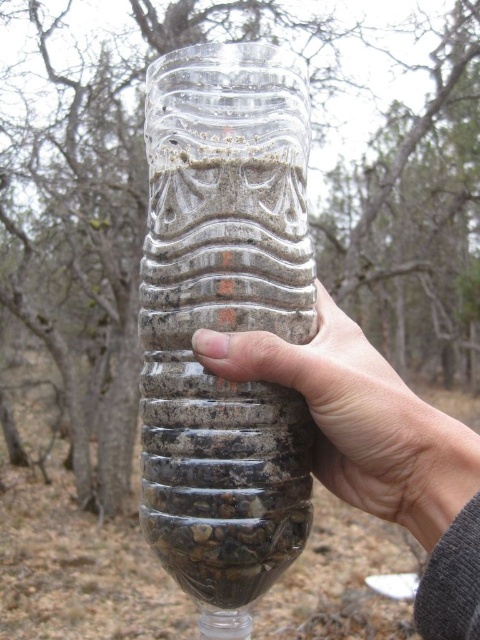
You are trying to choose between two containers to store some gardening soil. You have a clear textured glass jar at center and a clear plastic bottle at center. Which one is taller?

The clear textured glass jar at center is taller than the clear plastic bottle at center.

You are a delivery person who needs to place the clear textured glass jar at center into a box that can only hold items within a 10cm radius from the center. Is the jar positioned correctly within the box?

The clear textured glass jar at center is located at point (x=225, y=321), which is within the 10cm radius from the center, so the jar is positioned correctly within the box.